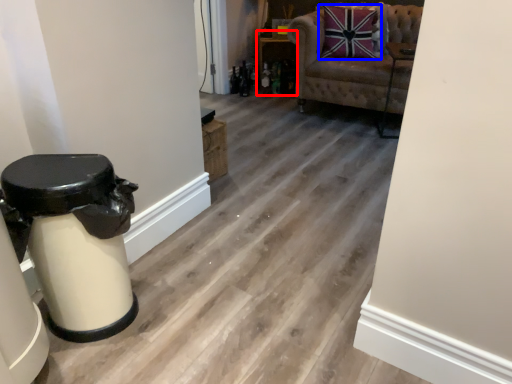
Question: Which object appears closest to the camera in this image, furniture (highlighted by a red box) or pillow (highlighted by a blue box)?

Choices:
 (A) furniture
 (B) pillow

Answer: (B)